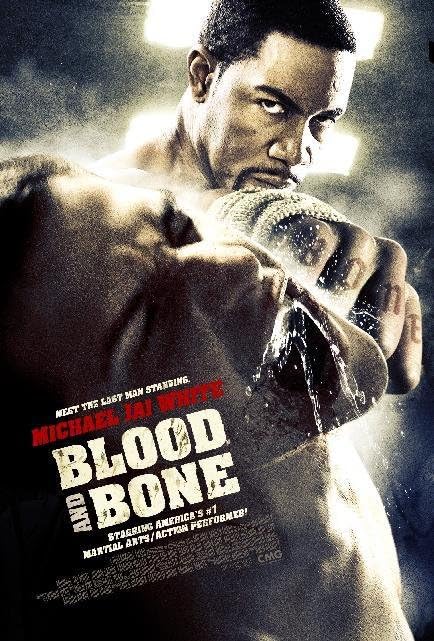
At what (x,y) coordinates should I click in order to perform the action: click on poster. Please return your answer as a coordinate pair (x, y). Looking at the image, I should click on (271, 385).